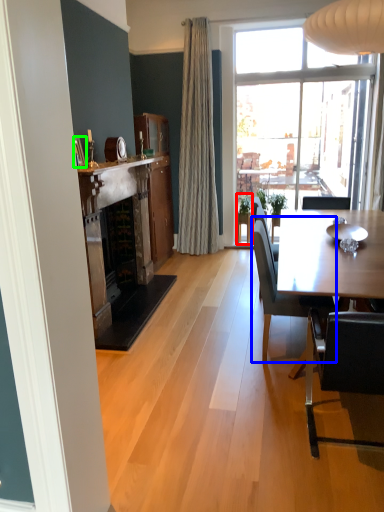
Question: Based on their relative distances, which object is nearer to houseplant (highlighted by a red box)? Choose from chair (highlighted by a blue box) and picture frame (highlighted by a green box).

Choices:
 (A) chair
 (B) picture frame

Answer: (A)